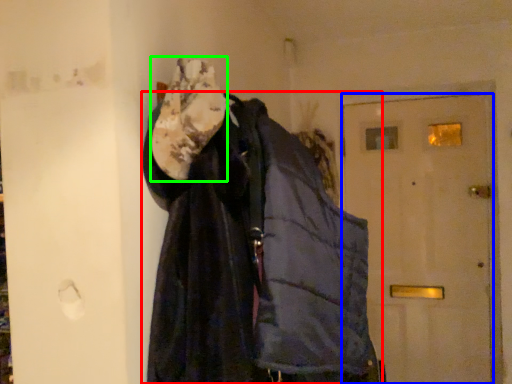
Question: Considering the real-world distances, which object is closest to jacket (highlighted by a red box)? door (highlighted by a blue box) or scarf (highlighted by a green box).

Choices:
 (A) door
 (B) scarf

Answer: (B)